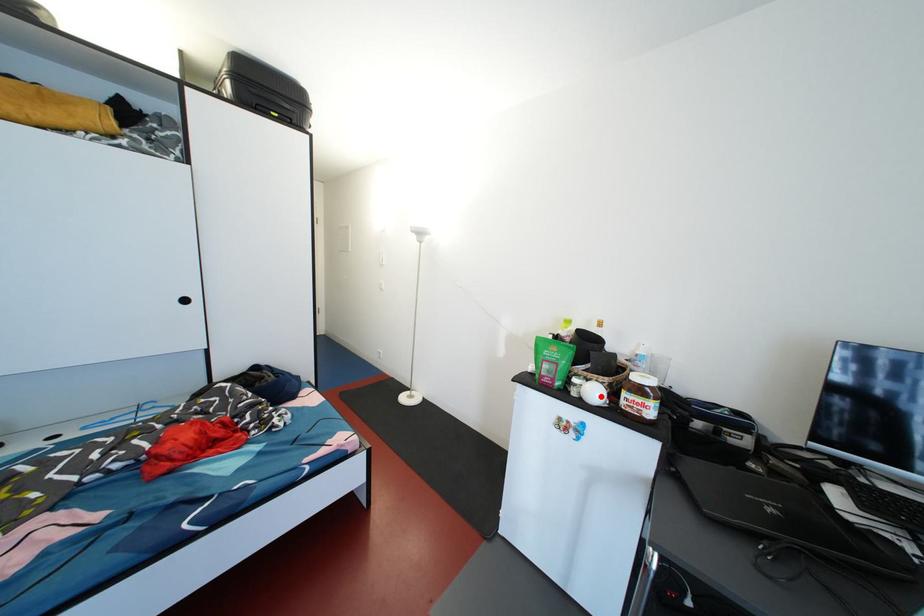
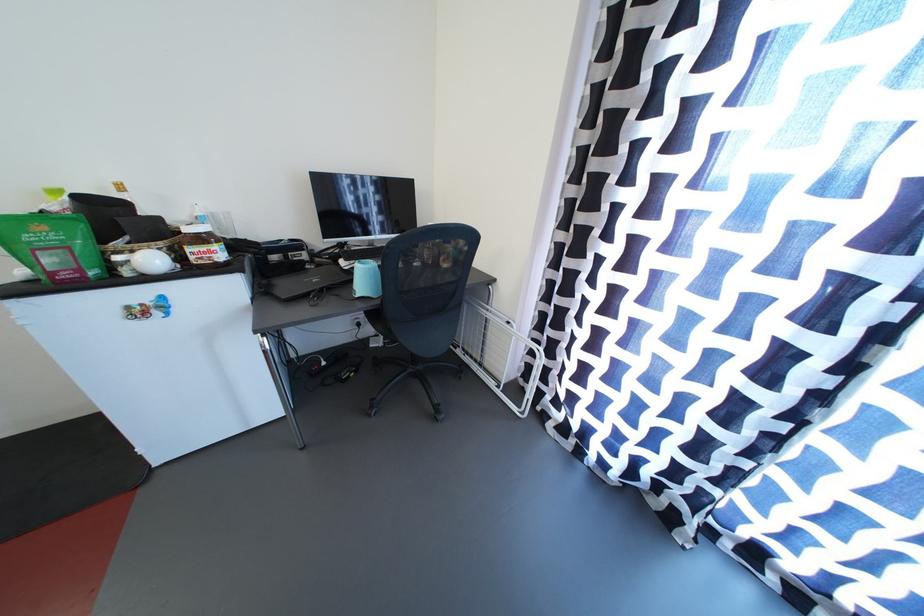
Find the pixel in the second image that matches the highlighted location in the first image.

(157, 265)